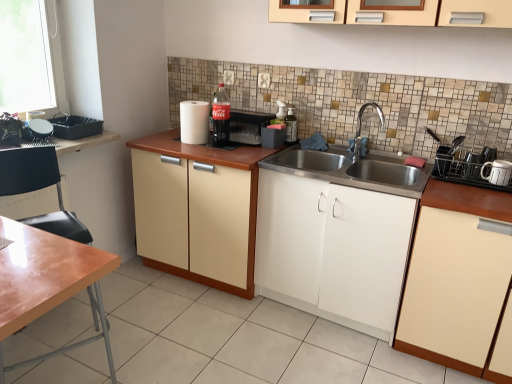
Question: From a real-world perspective, is black plastic toaster at right, the second appliance in the right-to-left sequence, physically located above or below silver metallic faucet at center?

Choices:
 (A) above
 (B) below

Answer: (B)

Question: From the image's perspective, is black plastic toaster at right, the 5th appliance from the left, positioned above or below silver metallic faucet at center?

Choices:
 (A) above
 (B) below

Answer: (B)

Question: Based on their relative distances, which object is farther from the matte glass bottle at center, the first bottle viewed from the left?

Choices:
 (A) matte cream cabinet at center, the 3th cabinetry when ordered from right to left
 (B) transparent glass bottle at upper center, acting as the 2th bottle starting from the left
 (C) white ceramic mug at right, marked as the sixth appliance in a left-to-right arrangement
 (D) matte cream cabinet at lower right, the first cabinetry viewed from the right
 (E) black plastic toaster at right, the 5th appliance from the left

Answer: (C)

Question: Which of these objects is positioned farthest from the matte cream cabinet at lower right, acting as the 3th cabinetry starting from the left?

Choices:
 (A) silver metallic faucet at center
 (B) white matte cabinet at center, positioned as the 2th cabinetry in right-to-left order
 (C) matte plastic container at center, arranged as the 3th appliance when viewed from the right
 (D) matte glass bottle at center, placed as the second bottle when sorted from right to left
 (E) matte cream cabinet at center, which is counted as the 1th cabinetry, starting from the left

Answer: (D)